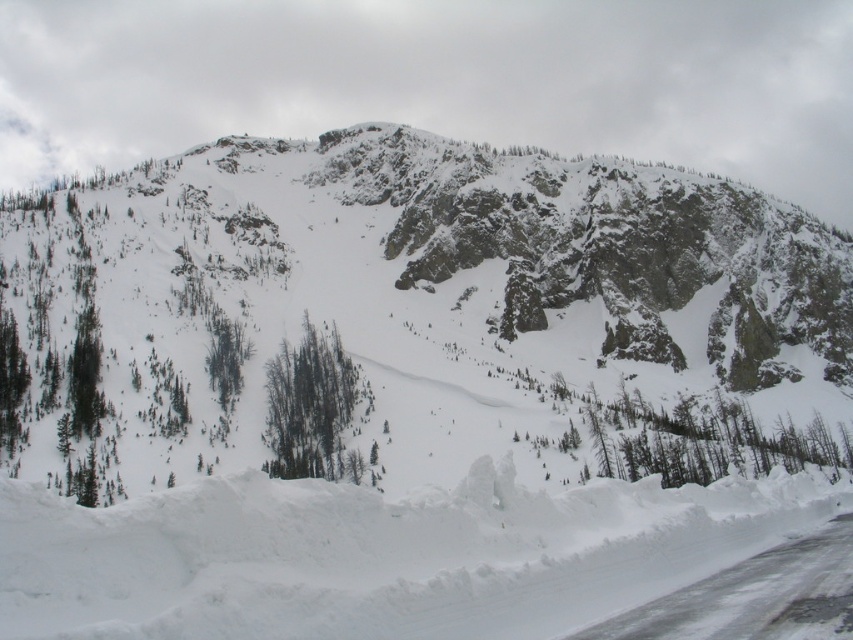
Question: Can you confirm if white snow at center is smaller than green matte trees at center?

Choices:
 (A) no
 (B) yes

Answer: (A)

Question: Is white snow at center thinner than green matte trees at center?

Choices:
 (A) yes
 (B) no

Answer: (B)

Question: Which point appears farthest from the camera in this image?

Choices:
 (A) (339, 531)
 (B) (317, 424)
 (C) (386, 412)

Answer: (C)

Question: Which object is farther from the camera taking this photo?

Choices:
 (A) green matte trees at center
 (B) white snow at center
 (C) white rocky mountain at center

Answer: (A)

Question: Which object is positioned closest to the white snow at center?

Choices:
 (A) white rocky mountain at center
 (B) green matte trees at center

Answer: (B)

Question: Can you confirm if white rocky mountain at center is wider than white snow at center?

Choices:
 (A) yes
 (B) no

Answer: (A)